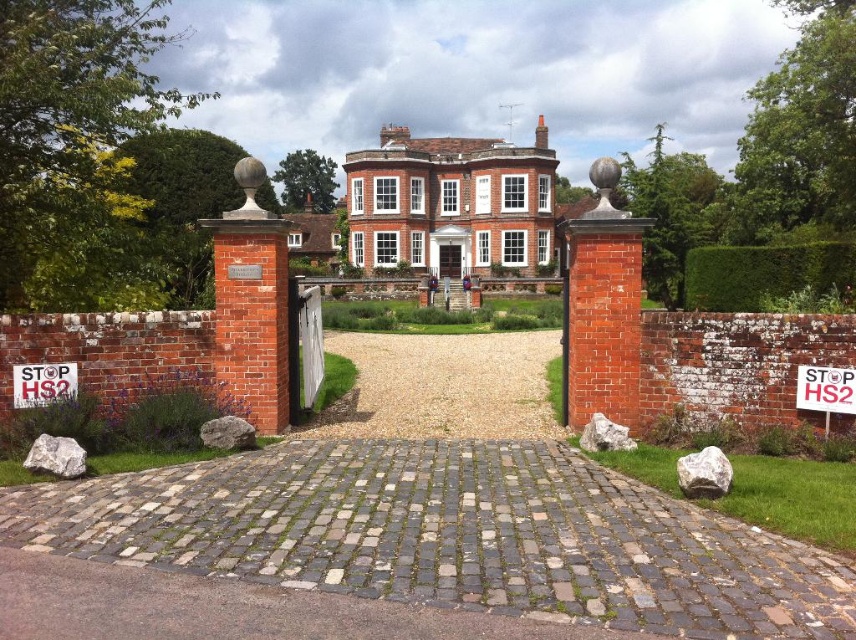
Can you confirm if green leafy hedge at right is smaller than white paper sign at left?

Incorrect, green leafy hedge at right is not smaller in size than white paper sign at left.

Which of these two, green leafy hedge at right or white paper sign at left, stands taller?

green leafy hedge at right is taller.

Does point (825, 262) lie behind point (70, 385)?

Yes.

In order to click on green leafy hedge at right in this screenshot , I will do `click(764, 273)`.

Which of these two, green leafy hedge at right or white paper sign at center, stands taller?

Standing taller between the two is green leafy hedge at right.

Who is more forward, (753, 296) or (835, 394)?

Positioned in front is point (835, 394).

Is point (822, 250) positioned after point (840, 368)?

Yes.

In order to click on green leafy hedge at right in this screenshot , I will do `click(764, 273)`.

How far apart are gray cobblestone driveway at center and green leafy hedge at right?

A distance of 27.29 meters exists between gray cobblestone driveway at center and green leafy hedge at right.

Is gray cobblestone driveway at center wider than green leafy hedge at right?

Correct, the width of gray cobblestone driveway at center exceeds that of green leafy hedge at right.

Does point (27, 538) come closer to viewer compared to point (746, 276)?

That is True.

You are a GUI agent. You are given a task and a screenshot of the screen. Output one action in this format:
    pyautogui.click(x=<x>, y=<y>)
    Task: Click on the gray cobblestone driveway at center
    This screenshot has height=640, width=856.
    Given the screenshot: What is the action you would take?
    450,536